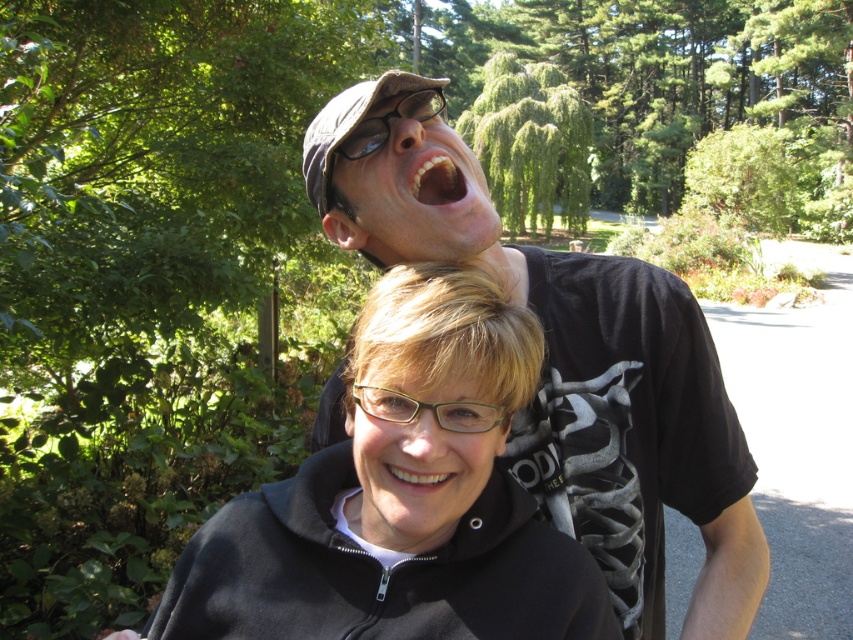
You are a photographer trying to capture a closeup of the black matte jacket at center. According to the scene description, where exactly should you focus your camera?

You should focus your camera at point (401,497) to capture the black matte jacket at center.

You are a photographer trying to capture a candid shot of both sets of white glossy teeth at upper center and white glossy teeth at center. Since you want to ensure both are visible clearly in the photo, which set of teeth should you focus on to account for their size difference?

You should focus on the white glossy teeth at upper center because it is larger in size than the white glossy teeth at center, making it easier to capture clearly even if slightly out of focus.